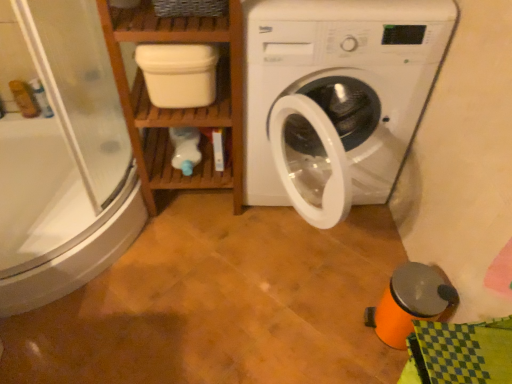
Where is `free area in between white plastic washing machine at center and wooden shelf at left`? This screenshot has height=384, width=512. free area in between white plastic washing machine at center and wooden shelf at left is located at coordinates coord(212,245).